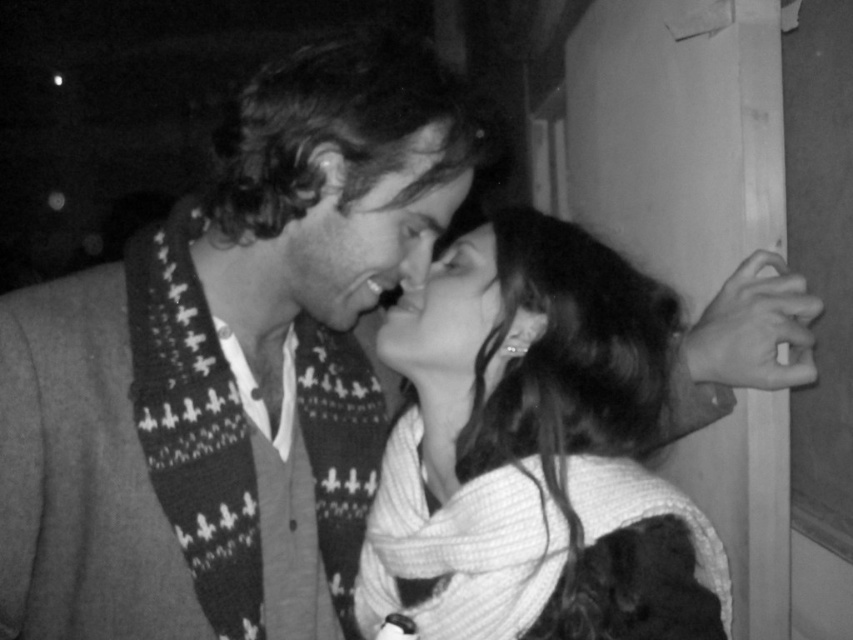
You are an artist trying to sketch the scene. You notice two central elements in the image. Which one is positioned lower down between the white textured scarf at center and the smooth skin face at center?

The white textured scarf at center is located below the smooth skin face at center, so it is positioned lower down.

You are an artist trying to sketch the scene. You want to place a knitted scarf at center in your drawing. Where exactly should you position it?

You should position the knitted scarf at center at point [367,230].